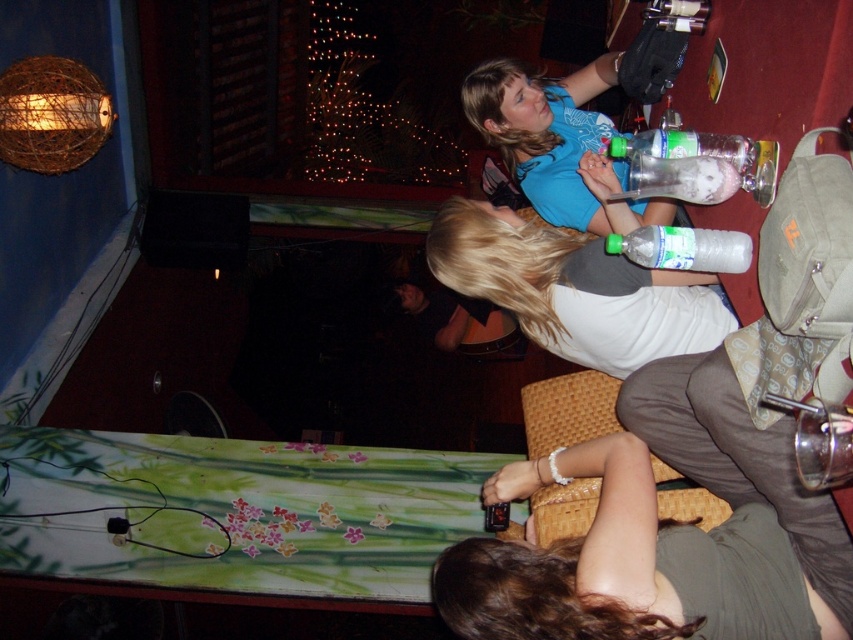
Question: Which of the following is the farthest from the observer?

Choices:
 (A) (672, 250)
 (B) (682, 179)

Answer: (B)

Question: Is dark green fabric at lower right bigger than blue fabric shirt at upper center?

Choices:
 (A) no
 (B) yes

Answer: (A)

Question: Which point is closer to the camera?

Choices:
 (A) (614, 58)
 (B) (727, 257)
 (C) (555, 301)

Answer: (B)

Question: Which of the following is the closest to the observer?

Choices:
 (A) translucent plastic bottle at upper right
 (B) translucent plastic bottle at upper center

Answer: (B)

Question: Can you confirm if blue fabric shirt at upper center is smaller than translucent plastic bottle at upper center?

Choices:
 (A) yes
 (B) no

Answer: (B)

Question: Can you confirm if dark green fabric at lower right is positioned below woven brown chair at lower center?

Choices:
 (A) yes
 (B) no

Answer: (B)